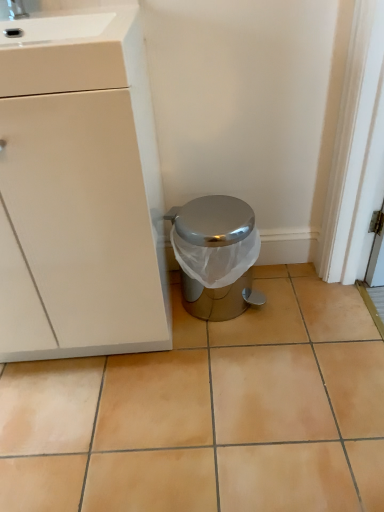
Where is `free space above beige ceramic tile at center (from a real-world perspective)`? The image size is (384, 512). free space above beige ceramic tile at center (from a real-world perspective) is located at coordinates (218, 369).